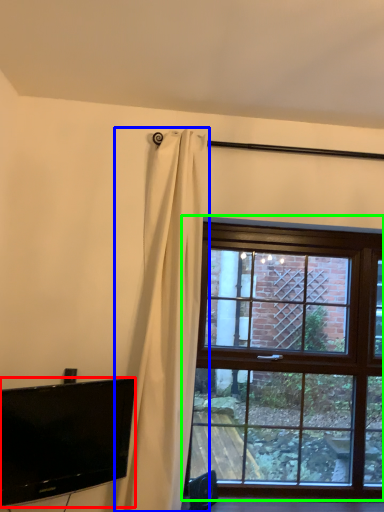
Question: Which object is the farthest from television (highlighted by a red box)? Choose among these: curtain (highlighted by a blue box) or window (highlighted by a green box).

Choices:
 (A) curtain
 (B) window

Answer: (B)